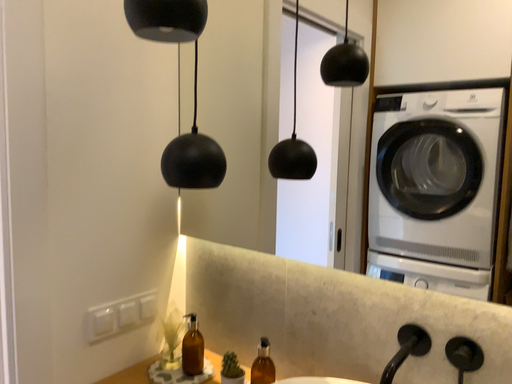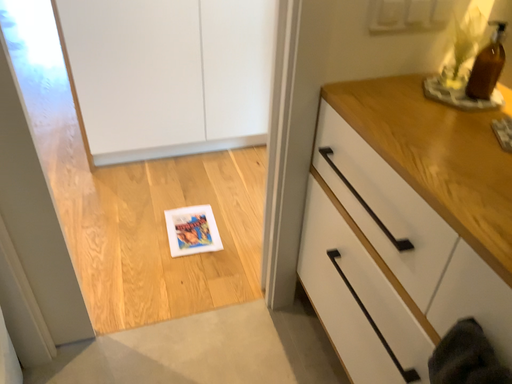
Question: Which way did the camera rotate in the video?

Choices:
 (A) rotated downward
 (B) rotated upward

Answer: (A)